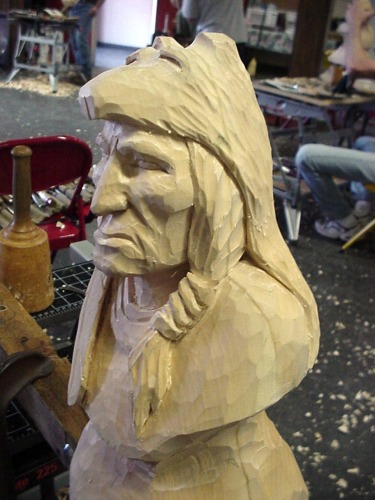
Find the location of a particular element. This screenshot has width=375, height=500. sculpture is located at coordinates (301, 365).